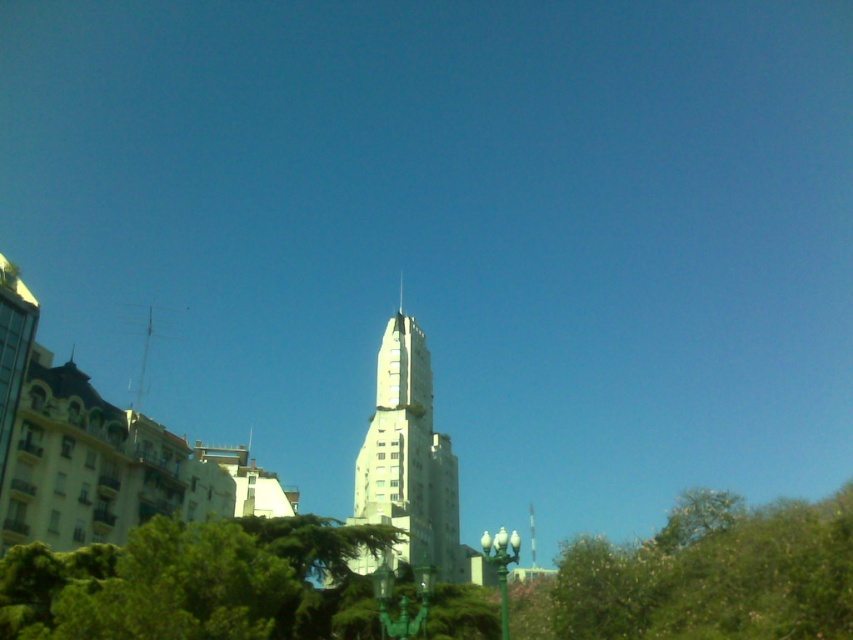
You are a city planner assessing the space between the green leafy tree at lower right and the white stone spire at center. If the tree is wider than the spire, will it block the view of the spire from the nearby park benches?

The green leafy tree at lower right is wider than the white stone spire at center, so it may block the view of the spire from the park benches depending on their placement.

You are an architect analyzing the cityscape. You notice the white smooth tower at center and the white stone spire at center. Which of these two structures has a greater height?

The white smooth tower at center has a larger size compared to the white stone spire at center, so it is taller.